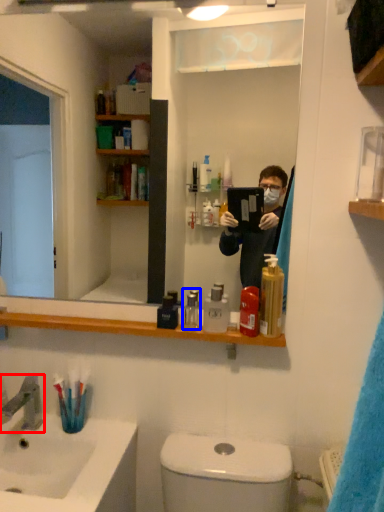
Question: Which point is further to the camera, tap (highlighted by a red box) or mouthwash (highlighted by a blue box)?

Choices:
 (A) tap
 (B) mouthwash

Answer: (B)